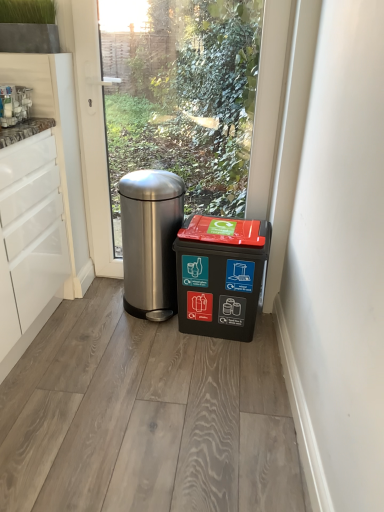
What do you see at coordinates (150, 240) in the screenshot?
I see `polished stainless steel trash can at center, positioned as the first waste container in left-to-right order` at bounding box center [150, 240].

At what (x,y) coordinates should I click in order to perform the action: click on polished stainless steel trash can at center, the 2th waste container in the right-to-left sequence. Please return your answer as a coordinate pair (x, y). The width and height of the screenshot is (384, 512). Looking at the image, I should click on (150, 240).

In order to face polished stainless steel trash can at center, positioned as the first waste container in left-to-right order, should I rotate leftwards or rightwards?

Turn left approximately 5.490 degrees to face it.

What do you see at coordinates (220, 275) in the screenshot? This screenshot has height=512, width=384. I see `black plastic recycling bin at lower right, which appears as the second waste container when viewed from the left` at bounding box center [220, 275].

Where is `black plastic recycling bin at lower right, acting as the first waste container starting from the right`? black plastic recycling bin at lower right, acting as the first waste container starting from the right is located at coordinates (220, 275).

Locate an element on the screen. This screenshot has width=384, height=512. polished stainless steel trash can at center, positioned as the first waste container in left-to-right order is located at coordinates (150, 240).

Considering the positions of objects black plastic recycling bin at lower right, acting as the first waste container starting from the right, and polished stainless steel trash can at center, positioned as the first waste container in left-to-right order, in the image provided, who is more to the right, black plastic recycling bin at lower right, acting as the first waste container starting from the right, or polished stainless steel trash can at center, positioned as the first waste container in left-to-right order,?

black plastic recycling bin at lower right, acting as the first waste container starting from the right, is more to the right.

Relative to polished stainless steel trash can at center, positioned as the first waste container in left-to-right order, is black plastic recycling bin at lower right, which appears as the second waste container when viewed from the left, in front or behind?

black plastic recycling bin at lower right, which appears as the second waste container when viewed from the left, is positioned closer to the viewer than polished stainless steel trash can at center, positioned as the first waste container in left-to-right order.

Considering the positions of point (244, 260) and point (173, 234), is point (244, 260) closer or farther from the camera than point (173, 234)?

Point (244, 260) is closer to the camera than point (173, 234).

From the image's perspective, is black plastic recycling bin at lower right, which appears as the second waste container when viewed from the left, positioned above or below polished stainless steel trash can at center, the 2th waste container in the right-to-left sequence?

Clearly, from the image's perspective, black plastic recycling bin at lower right, which appears as the second waste container when viewed from the left, is below polished stainless steel trash can at center, the 2th waste container in the right-to-left sequence.

From a real-world perspective, who is located higher, black plastic recycling bin at lower right, acting as the first waste container starting from the right, or polished stainless steel trash can at center, the 2th waste container in the right-to-left sequence?

polished stainless steel trash can at center, the 2th waste container in the right-to-left sequence, is physically above.

Which of these two, black plastic recycling bin at lower right, which appears as the second waste container when viewed from the left, or polished stainless steel trash can at center, positioned as the first waste container in left-to-right order, is wider?

polished stainless steel trash can at center, positioned as the first waste container in left-to-right order.

Does black plastic recycling bin at lower right, acting as the first waste container starting from the right, have a greater height compared to polished stainless steel trash can at center, positioned as the first waste container in left-to-right order?

No, black plastic recycling bin at lower right, acting as the first waste container starting from the right, is not taller than polished stainless steel trash can at center, positioned as the first waste container in left-to-right order.

In terms of size, does black plastic recycling bin at lower right, which appears as the second waste container when viewed from the left, appear bigger or smaller than polished stainless steel trash can at center, the 2th waste container in the right-to-left sequence?

Considering their sizes, black plastic recycling bin at lower right, which appears as the second waste container when viewed from the left, takes up less space than polished stainless steel trash can at center, the 2th waste container in the right-to-left sequence.

Is polished stainless steel trash can at center, positioned as the first waste container in left-to-right order, completely or partially inside black plastic recycling bin at lower right, which appears as the second waste container when viewed from the left?

Actually, polished stainless steel trash can at center, positioned as the first waste container in left-to-right order, is outside black plastic recycling bin at lower right, which appears as the second waste container when viewed from the left.

Is black plastic recycling bin at lower right, acting as the first waste container starting from the right, placed right next to polished stainless steel trash can at center, the 2th waste container in the right-to-left sequence?

They are not placed beside each other.

Is polished stainless steel trash can at center, the 2th waste container in the right-to-left sequence, at the back of black plastic recycling bin at lower right, which appears as the second waste container when viewed from the left?

That's not correct — black plastic recycling bin at lower right, which appears as the second waste container when viewed from the left, is not looking away from polished stainless steel trash can at center, the 2th waste container in the right-to-left sequence.

Can you tell me how much black plastic recycling bin at lower right, acting as the first waste container starting from the right, and polished stainless steel trash can at center, positioned as the first waste container in left-to-right order, differ in facing direction?

There is a 5.18-degree angle between the facing directions of black plastic recycling bin at lower right, acting as the first waste container starting from the right, and polished stainless steel trash can at center, positioned as the first waste container in left-to-right order.

At what (x,y) coordinates should I click in order to perform the action: click on waste container that appears on the left of black plastic recycling bin at lower right, acting as the first waste container starting from the right. Please return your answer as a coordinate pair (x, y). This screenshot has width=384, height=512. Looking at the image, I should click on (150, 240).

Is polished stainless steel trash can at center, positioned as the first waste container in left-to-right order, to the left or to the right of black plastic recycling bin at lower right, which appears as the second waste container when viewed from the left, in the image?

polished stainless steel trash can at center, positioned as the first waste container in left-to-right order, is to the left of black plastic recycling bin at lower right, which appears as the second waste container when viewed from the left.

Relative to black plastic recycling bin at lower right, acting as the first waste container starting from the right, is polished stainless steel trash can at center, the 2th waste container in the right-to-left sequence, in front or behind?

In the image, polished stainless steel trash can at center, the 2th waste container in the right-to-left sequence, appears behind black plastic recycling bin at lower right, acting as the first waste container starting from the right.

Is point (140, 255) positioned before point (247, 268)?

No, (140, 255) is further to viewer.

From the image's perspective, which object appears higher, polished stainless steel trash can at center, positioned as the first waste container in left-to-right order, or black plastic recycling bin at lower right, acting as the first waste container starting from the right?

polished stainless steel trash can at center, positioned as the first waste container in left-to-right order, from the image's perspective.

From a real-world perspective, does polished stainless steel trash can at center, positioned as the first waste container in left-to-right order, sit lower than black plastic recycling bin at lower right, which appears as the second waste container when viewed from the left?

No, from a real-world perspective, polished stainless steel trash can at center, positioned as the first waste container in left-to-right order, is not under black plastic recycling bin at lower right, which appears as the second waste container when viewed from the left.

Is polished stainless steel trash can at center, positioned as the first waste container in left-to-right order, thinner than black plastic recycling bin at lower right, which appears as the second waste container when viewed from the left?

Incorrect, the width of polished stainless steel trash can at center, positioned as the first waste container in left-to-right order, is not less than that of black plastic recycling bin at lower right, which appears as the second waste container when viewed from the left.

Does polished stainless steel trash can at center, the 2th waste container in the right-to-left sequence, have a lesser height compared to black plastic recycling bin at lower right, acting as the first waste container starting from the right?

No, polished stainless steel trash can at center, the 2th waste container in the right-to-left sequence, is not shorter than black plastic recycling bin at lower right, acting as the first waste container starting from the right.

Which of these two, polished stainless steel trash can at center, positioned as the first waste container in left-to-right order, or black plastic recycling bin at lower right, acting as the first waste container starting from the right, is bigger?

With larger size is polished stainless steel trash can at center, positioned as the first waste container in left-to-right order.

Is polished stainless steel trash can at center, positioned as the first waste container in left-to-right order, not within black plastic recycling bin at lower right, acting as the first waste container starting from the right?

Yes, polished stainless steel trash can at center, positioned as the first waste container in left-to-right order, is outside of black plastic recycling bin at lower right, acting as the first waste container starting from the right.

Is polished stainless steel trash can at center, positioned as the first waste container in left-to-right order, far from black plastic recycling bin at lower right, acting as the first waste container starting from the right?

polished stainless steel trash can at center, positioned as the first waste container in left-to-right order, is actually quite close to black plastic recycling bin at lower right, acting as the first waste container starting from the right.

Is polished stainless steel trash can at center, positioned as the first waste container in left-to-right order, aimed at black plastic recycling bin at lower right, acting as the first waste container starting from the right?

No, polished stainless steel trash can at center, positioned as the first waste container in left-to-right order, does not turn towards black plastic recycling bin at lower right, acting as the first waste container starting from the right.

In the image, there is a black plastic recycling bin at lower right, acting as the first waste container starting from the right. Where is `waste container above it (from the image's perspective)`? The height and width of the screenshot is (512, 384). waste container above it (from the image's perspective) is located at coordinates (150, 240).

The height and width of the screenshot is (512, 384). Find the location of `waste container in front of the polished stainless steel trash can at center, the 2th waste container in the right-to-left sequence`. waste container in front of the polished stainless steel trash can at center, the 2th waste container in the right-to-left sequence is located at coordinates (220, 275).

Image resolution: width=384 pixels, height=512 pixels. Identify the location of waste container positioned vertically above the black plastic recycling bin at lower right, acting as the first waste container starting from the right (from a real-world perspective). (150, 240).